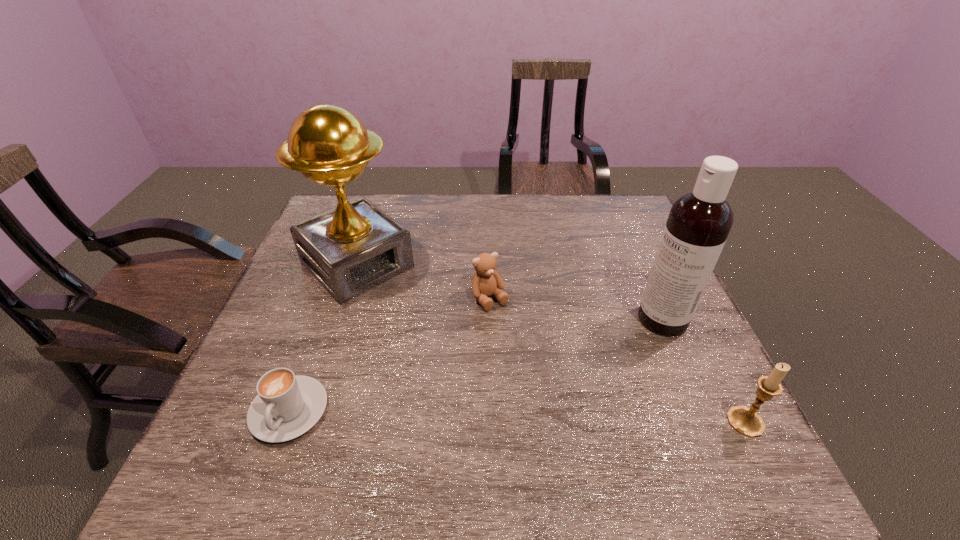
You are a GUI agent. You are given a task and a screenshot of the screen. Output one action in this format:
    pyautogui.click(x=<x>, y=<y>)
    Task: Click on the vacant space at the near left corner of the desktop
    The image size is (960, 540).
    Given the screenshot: What is the action you would take?
    pyautogui.click(x=239, y=410)

Where is `blank space at the far right corner of the desktop`? The height and width of the screenshot is (540, 960). blank space at the far right corner of the desktop is located at coordinates (595, 212).

The width and height of the screenshot is (960, 540). I want to click on vacant area that lies between the fourth tallest object and the candle holder, so [x=617, y=360].

Where is `free spot between the dishwasher detergent and the cappuccino`? This screenshot has height=540, width=960. free spot between the dishwasher detergent and the cappuccino is located at coordinates (476, 365).

Where is `free space between the cappuccino and the dishwasher detergent`? Image resolution: width=960 pixels, height=540 pixels. free space between the cappuccino and the dishwasher detergent is located at coordinates [476, 365].

At what (x,y) coordinates should I click in order to perform the action: click on vacant area that lies between the dishwasher detergent and the shortest object. Please return your answer as a coordinate pair (x, y). Image resolution: width=960 pixels, height=540 pixels. Looking at the image, I should click on (476, 365).

The height and width of the screenshot is (540, 960). Identify the location of vacant area that lies between the cappuccino and the dishwasher detergent. pyautogui.click(x=476, y=365).

Where is `free space between the third tallest object and the cappuccino`? free space between the third tallest object and the cappuccino is located at coordinates (517, 416).

The width and height of the screenshot is (960, 540). I want to click on vacant space that's between the award and the candle holder, so click(551, 343).

Identify the location of free point between the third object from left to right and the cappuccino. This screenshot has width=960, height=540. [x=390, y=355].